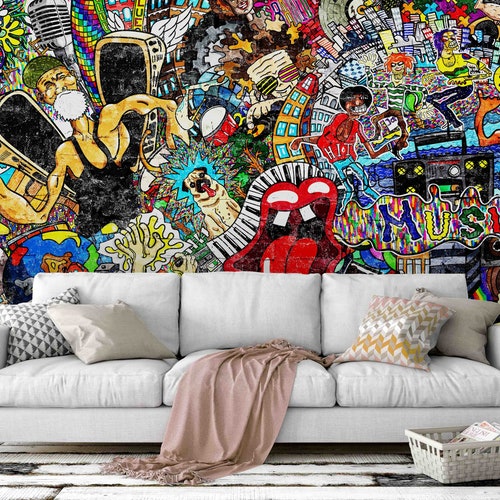
Where is `seat cushions`? The height and width of the screenshot is (500, 500). seat cushions is located at coordinates (146, 386), (313, 389), (412, 388).